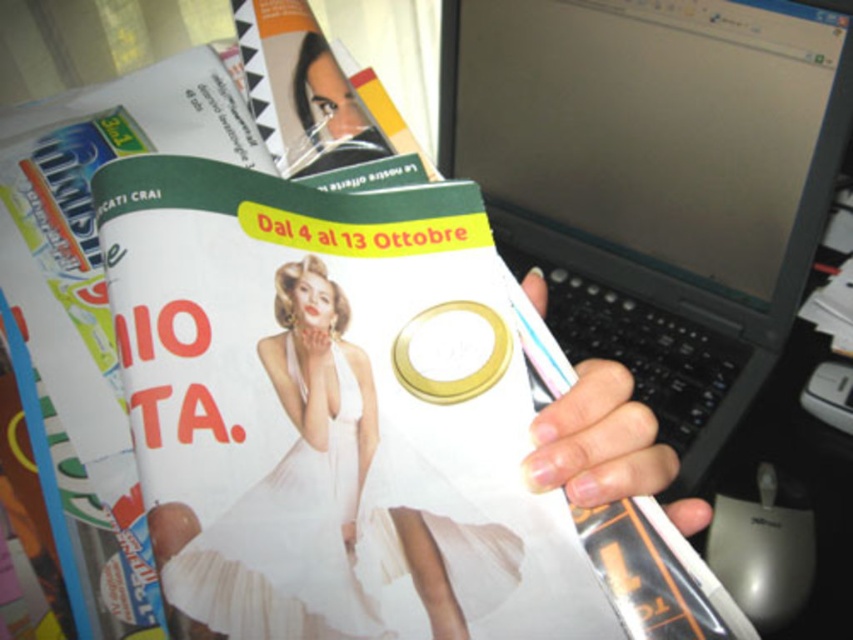
Question: Which is nearer to the smooth plastic face at upper center?

Choices:
 (A) nail polish at center
 (B) black plastic laptop at upper right

Answer: (A)

Question: Can you confirm if black plastic laptop at upper right is positioned to the left of smooth plastic face at upper center?

Choices:
 (A) yes
 (B) no

Answer: (B)

Question: Which of the following is the closest to the observer?

Choices:
 (A) black plastic laptop at upper right
 (B) smooth plastic face at upper center

Answer: (B)

Question: Considering the real-world distances, which object is farthest from the nail polish at center?

Choices:
 (A) smooth plastic face at upper center
 (B) black plastic laptop at upper right

Answer: (B)

Question: Is black plastic laptop at upper right wider than smooth plastic face at upper center?

Choices:
 (A) yes
 (B) no

Answer: (A)

Question: Considering the relative positions of black plastic laptop at upper right and smooth plastic face at upper center in the image provided, where is black plastic laptop at upper right located with respect to smooth plastic face at upper center?

Choices:
 (A) right
 (B) left

Answer: (A)